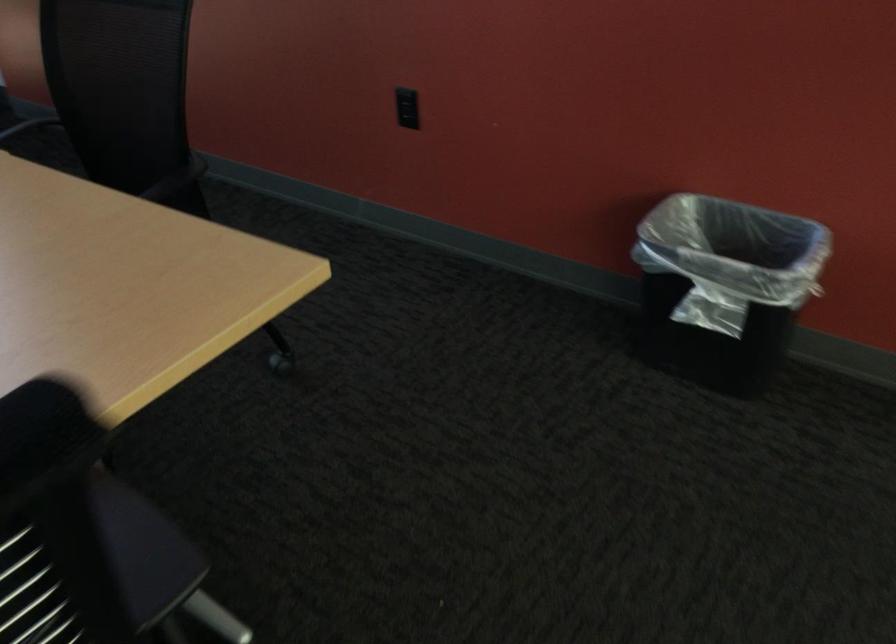
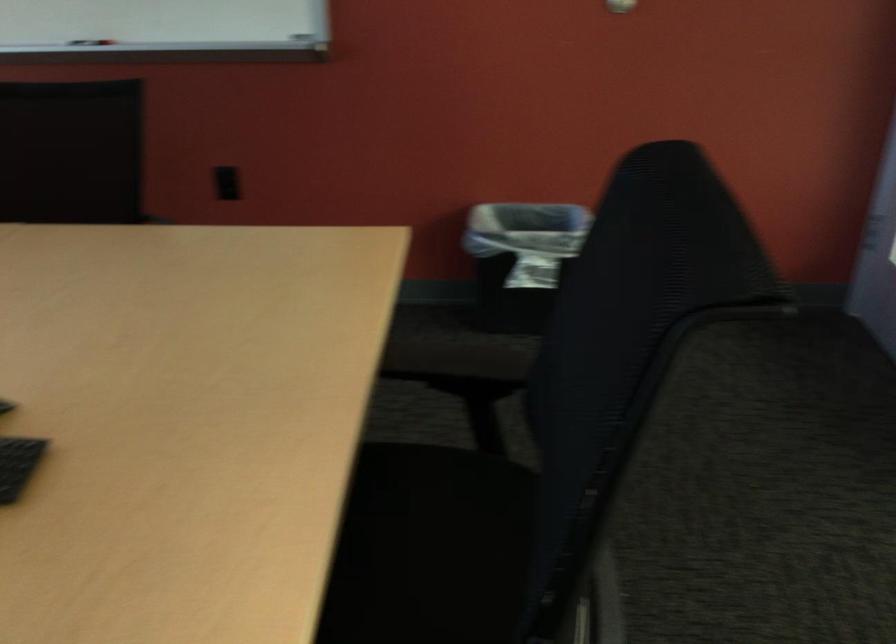
The point at [408,124] is marked in the first image. Where is the corresponding point in the second image?

(227, 183)